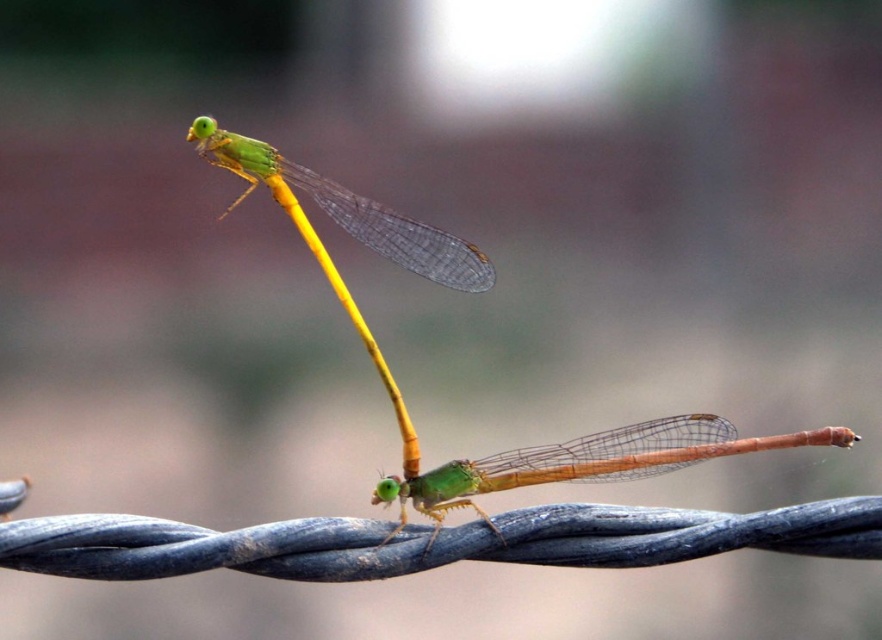
Can you confirm if green translucent wings at upper left is positioned to the right of translucent yellow stem at center?

No, green translucent wings at upper left is not to the right of translucent yellow stem at center.

I want to click on green translucent wings at upper left, so click(x=349, y=211).

This screenshot has width=882, height=640. Find the location of `green translucent wings at upper left`. green translucent wings at upper left is located at coordinates (349, 211).

The image size is (882, 640). I want to click on green translucent wings at upper left, so click(x=349, y=211).

Locate an element on the screen. This screenshot has width=882, height=640. metallic wire at center is located at coordinates (434, 541).

Is metallic wire at center to the right of green translucent wings at center from the viewer's perspective?

In fact, metallic wire at center is to the left of green translucent wings at center.

Describe the element at coordinates (434, 541) in the screenshot. I see `metallic wire at center` at that location.

You are a GUI agent. You are given a task and a screenshot of the screen. Output one action in this format:
    pyautogui.click(x=<x>, y=<y>)
    Task: Click on the metallic wire at center
    The width and height of the screenshot is (882, 640).
    Given the screenshot: What is the action you would take?
    pyautogui.click(x=434, y=541)

The height and width of the screenshot is (640, 882). What do you see at coordinates (434, 541) in the screenshot?
I see `metallic wire at center` at bounding box center [434, 541].

Which of these two, metallic wire at center or translucent yellow stem at center, stands shorter?

With less height is metallic wire at center.

What are the coordinates of `metallic wire at center` in the screenshot? It's located at (434, 541).